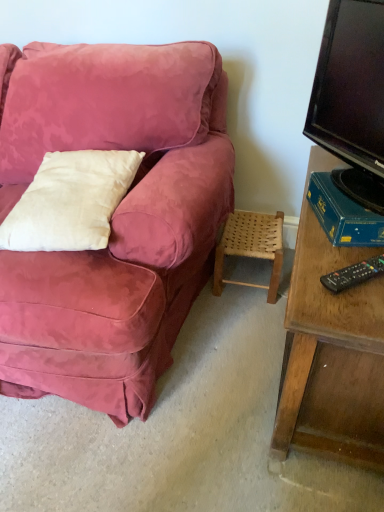
The image size is (384, 512). Find the location of `free spot above blue cardboard book at right (from a real-world perspective)`. free spot above blue cardboard book at right (from a real-world perspective) is located at coordinates (361, 192).